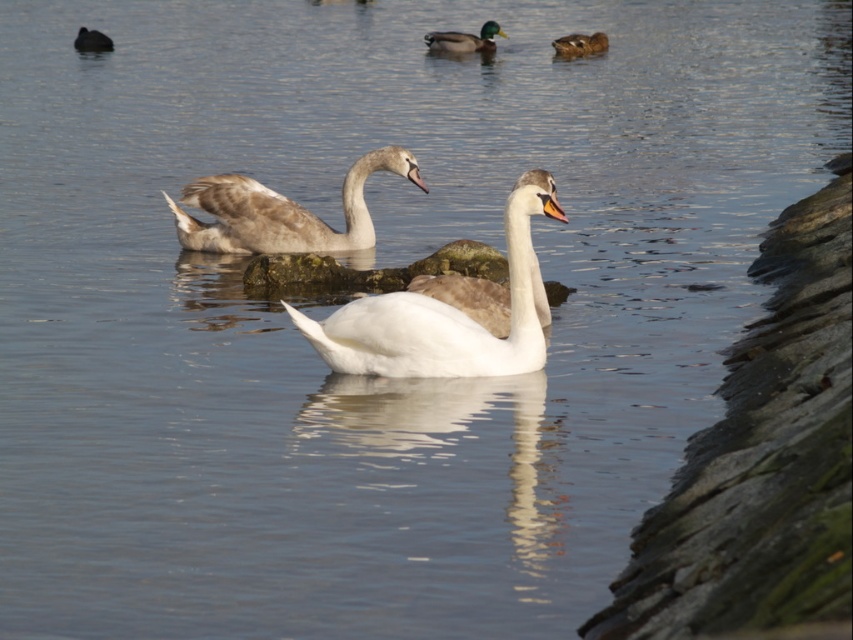
Is white glossy swan at center positioned behind dark gray matte duck at upper left?

No, white glossy swan at center is in front of dark gray matte duck at upper left.

The width and height of the screenshot is (853, 640). Find the location of `white glossy swan at center`. white glossy swan at center is located at coordinates (445, 314).

Can you confirm if brown glossy duck at upper center is taller than dark gray matte duck at upper left?

In fact, brown glossy duck at upper center may be shorter than dark gray matte duck at upper left.

Can you confirm if brown glossy duck at upper center is shorter than dark gray matte duck at upper left?

Correct, brown glossy duck at upper center is not as tall as dark gray matte duck at upper left.

What do you see at coordinates (579, 44) in the screenshot? The height and width of the screenshot is (640, 853). I see `brown glossy duck at upper center` at bounding box center [579, 44].

At what (x,y) coordinates should I click in order to perform the action: click on brown glossy duck at upper center. Please return your answer as a coordinate pair (x, y). This screenshot has height=640, width=853. Looking at the image, I should click on (579, 44).

Which is more to the right, brown feathered swan at center or brown glossy duck at upper center?

From the viewer's perspective, brown glossy duck at upper center appears more on the right side.

Does brown feathered swan at center have a larger size compared to brown glossy duck at upper center?

Yes.

Identify the location of brown feathered swan at center. This screenshot has width=853, height=640. (281, 211).